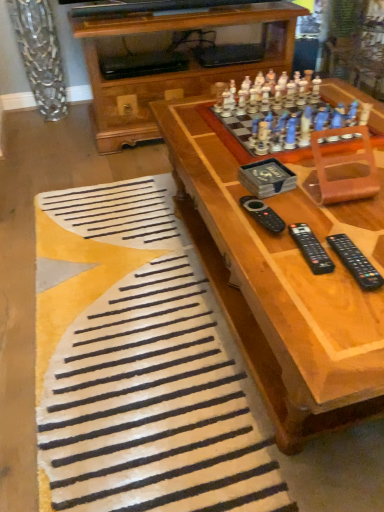
At what (x,y) coordinates should I click in order to perform the action: click on vacant space behind black plastic remote at lower right, acting as the 2th remote starting from the right. Please return your answer as a coordinate pair (x, y). The height and width of the screenshot is (512, 384). Looking at the image, I should click on (297, 208).